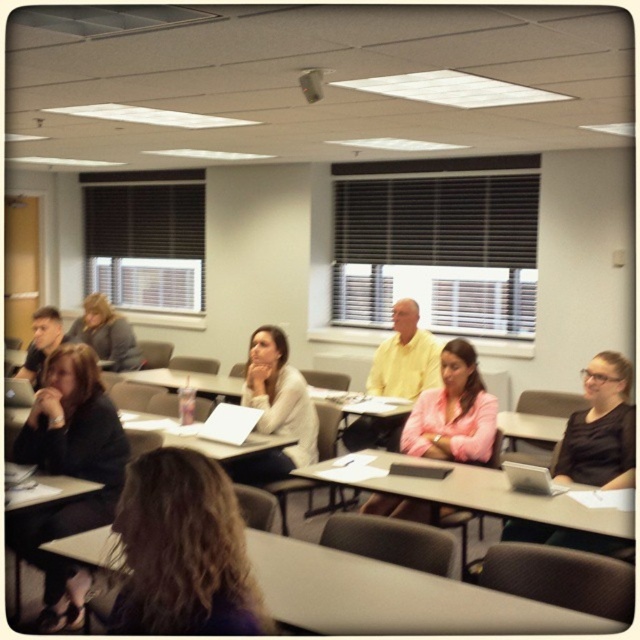
Which is more to the left, matte white sweater at center or white plastic table at center?

white plastic table at center is more to the left.

Between matte white sweater at center and white plastic table at center, which one is positioned higher?

matte white sweater at center is above.

Where is `matte white sweater at center`? The height and width of the screenshot is (640, 640). matte white sweater at center is located at coordinates (275, 410).

Where is `matte white sweater at center`? This screenshot has width=640, height=640. matte white sweater at center is located at coordinates (275, 410).

Can you confirm if matte gray table at center is bigger than white plastic table at center?

Indeed, matte gray table at center has a larger size compared to white plastic table at center.

Does matte gray table at center have a greater height compared to white plastic table at center?

No.

Is point (506, 493) in front of point (131, 420)?

Yes, it is.

I want to click on matte gray table at center, so click(x=476, y=493).

Is matte gray table at center below light brown hair at center?

Indeed, matte gray table at center is positioned under light brown hair at center.

Who is taller, matte gray table at center or light brown hair at center?

With more height is light brown hair at center.

You are a GUI agent. You are given a task and a screenshot of the screen. Output one action in this format:
    pyautogui.click(x=<x>, y=<y>)
    Task: Click on the matte gray table at center
    The image size is (640, 640).
    Given the screenshot: What is the action you would take?
    pyautogui.click(x=476, y=493)

Identify the location of matte gray table at center. (476, 493).